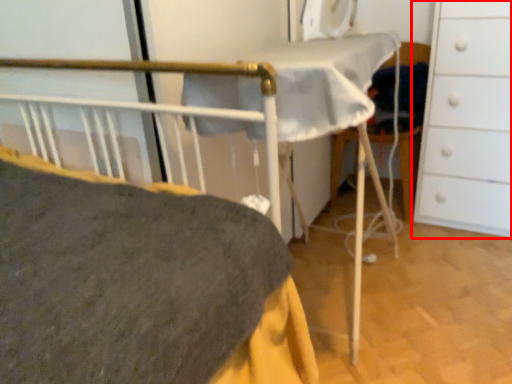
Question: Observing the image, what is the correct spatial positioning of chest of drawers (annotated by the red box) in reference to folding chair?

Choices:
 (A) right
 (B) left

Answer: (A)